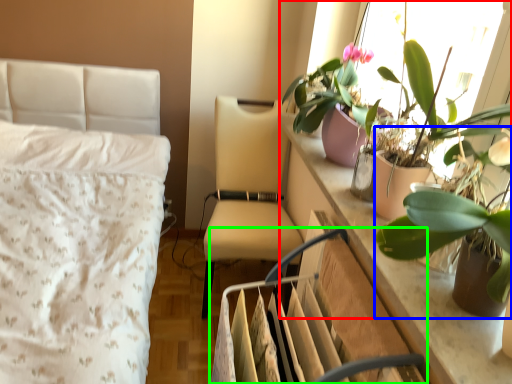
Question: Which object is the closest to the houseplant (highlighted by a red box)? Choose among these: houseplant (highlighted by a blue box) or swivel chair (highlighted by a green box).

Choices:
 (A) houseplant
 (B) swivel chair

Answer: (A)